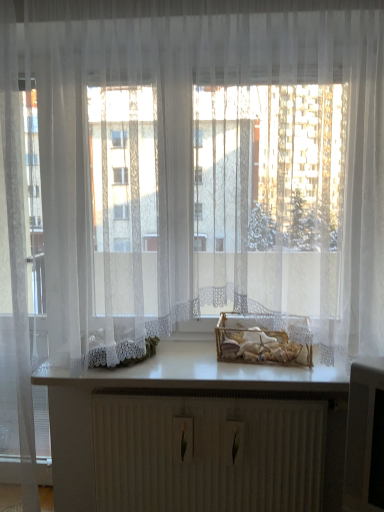
Question: Is white matte counter top at center shorter than white textured radiator at center?

Choices:
 (A) no
 (B) yes

Answer: (B)

Question: Is white matte counter top at center in contact with white textured radiator at center?

Choices:
 (A) no
 (B) yes

Answer: (A)

Question: Considering the relative sizes of white matte counter top at center and white textured radiator at center in the image provided, is white matte counter top at center taller than white textured radiator at center?

Choices:
 (A) no
 (B) yes

Answer: (A)

Question: Is white matte counter top at center smaller than white textured radiator at center?

Choices:
 (A) no
 (B) yes

Answer: (B)

Question: Can you confirm if white matte counter top at center is positioned to the left of white textured radiator at center?

Choices:
 (A) yes
 (B) no

Answer: (A)

Question: Is white matte counter top at center wider or thinner than transparent glass door at left?

Choices:
 (A) thin
 (B) wide

Answer: (B)

Question: Would you say white matte counter top at center is inside or outside transparent glass door at left?

Choices:
 (A) inside
 (B) outside

Answer: (B)

Question: Visually, is white matte counter top at center positioned to the left or to the right of transparent glass door at left?

Choices:
 (A) left
 (B) right

Answer: (B)

Question: From the image's perspective, is white matte counter top at center located above or below transparent glass door at left?

Choices:
 (A) below
 (B) above

Answer: (A)

Question: From the image's perspective, is white textured radiator at center located above or below transparent glass door at left?

Choices:
 (A) above
 (B) below

Answer: (B)

Question: Is white textured radiator at center taller or shorter than transparent glass door at left?

Choices:
 (A) tall
 (B) short

Answer: (B)

Question: From a real-world perspective, is white textured radiator at center positioned above or below transparent glass door at left?

Choices:
 (A) above
 (B) below

Answer: (B)

Question: In terms of size, does white textured radiator at center appear bigger or smaller than transparent glass door at left?

Choices:
 (A) small
 (B) big

Answer: (A)

Question: Based on their sizes in the image, would you say translucent glass basket at center is bigger or smaller than transparent glass door at left?

Choices:
 (A) big
 (B) small

Answer: (B)

Question: From a real-world perspective, is translucent glass basket at center physically located above or below transparent glass door at left?

Choices:
 (A) above
 (B) below

Answer: (B)